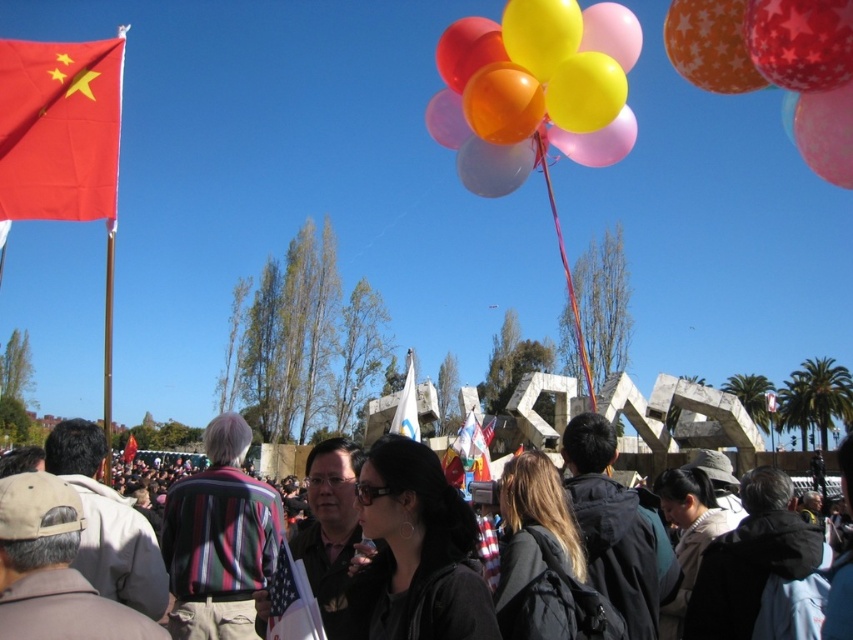
Measure the distance between multicolored fabric flag at center and matte red flag at upper left.

multicolored fabric flag at center and matte red flag at upper left are 103.19 meters apart from each other.

How far apart are multicolored fabric flag at center and matte red flag at upper left?

A distance of 103.19 meters exists between multicolored fabric flag at center and matte red flag at upper left.

This screenshot has height=640, width=853. I want to click on multicolored fabric flag at center, so click(x=468, y=452).

Where is `multicolored fabric flag at center`? This screenshot has width=853, height=640. multicolored fabric flag at center is located at coordinates (468, 452).

Is matte black jacket at center thinner than matte red flag at upper left?

Correct, matte black jacket at center's width is less than matte red flag at upper left's.

Between matte black jacket at center and matte red flag at upper left, which one appears on the left side from the viewer's perspective?

Positioned to the left is matte red flag at upper left.

This screenshot has height=640, width=853. Describe the element at coordinates (329, 529) in the screenshot. I see `matte black jacket at center` at that location.

Where is `matte black jacket at center`? This screenshot has height=640, width=853. matte black jacket at center is located at coordinates (329, 529).

How much distance is there between striped fabric shirt at center and orange star-patterned balloon at upper right?

striped fabric shirt at center and orange star-patterned balloon at upper right are 218.67 feet apart from each other.

Which is below, striped fabric shirt at center or orange star-patterned balloon at upper right?

striped fabric shirt at center is below.

Image resolution: width=853 pixels, height=640 pixels. Describe the element at coordinates (219, 540) in the screenshot. I see `striped fabric shirt at center` at that location.

Locate an element on the screen. striped fabric shirt at center is located at coordinates (219, 540).